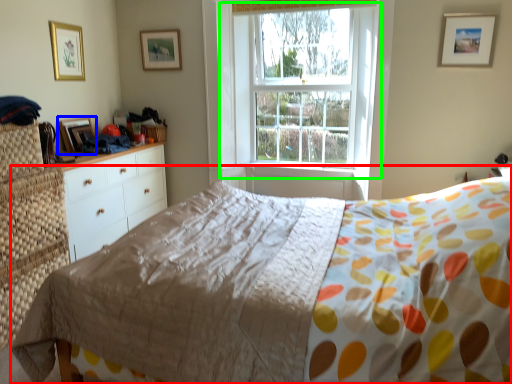
Question: Estimate the real-world distances between objects in this image. Which object is closer to bed (highlighted by a red box), picture frame (highlighted by a blue box) or window (highlighted by a green box)?

Choices:
 (A) picture frame
 (B) window

Answer: (B)